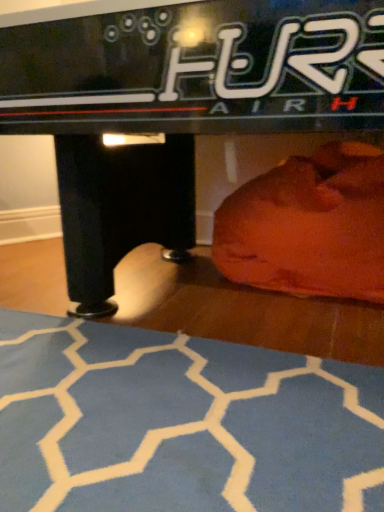
I want to click on blue textured yoga mat at lower center, so click(x=180, y=423).

Considering the positions of objects black glossy air hockey table at center and blue textured yoga mat at lower center in the image provided, who is in front, black glossy air hockey table at center or blue textured yoga mat at lower center?

blue textured yoga mat at lower center.

Could you measure the distance between black glossy air hockey table at center and blue textured yoga mat at lower center?

black glossy air hockey table at center is 21.52 inches from blue textured yoga mat at lower center.

From the image's perspective, is black glossy air hockey table at center under blue textured yoga mat at lower center?

Incorrect, from the image's perspective, black glossy air hockey table at center is higher than blue textured yoga mat at lower center.

Which object is positioned more to the left, black glossy air hockey table at center or blue textured yoga mat at lower center?

blue textured yoga mat at lower center is more to the left.

Can black glossy air hockey table at center be found inside blue textured yoga mat at lower center?

No, black glossy air hockey table at center is not a part of blue textured yoga mat at lower center.

Can you confirm if blue textured yoga mat at lower center is smaller than black glossy air hockey table at center?

Correct, blue textured yoga mat at lower center occupies less space than black glossy air hockey table at center.

From a real-world perspective, is blue textured yoga mat at lower center above or below black glossy air hockey table at center?

Clearly, from a real-world perspective, blue textured yoga mat at lower center is below black glossy air hockey table at center.

Is blue textured yoga mat at lower center positioned behind black glossy air hockey table at center?

No.

Which is more to the left, blue textured yoga mat at lower center or orange fabric bean bag at lower right?

blue textured yoga mat at lower center is more to the left.

Which object is closer to the camera taking this photo, blue textured yoga mat at lower center or orange fabric bean bag at lower right?

blue textured yoga mat at lower center is in front.

Is blue textured yoga mat at lower center not close to orange fabric bean bag at lower right?

blue textured yoga mat at lower center is actually quite close to orange fabric bean bag at lower right.

Which point is more forward, (210, 449) or (228, 238)?

Point (210, 449)

Which object is positioned more to the right, black glossy air hockey table at center or orange fabric bean bag at lower right?

From the viewer's perspective, orange fabric bean bag at lower right appears more on the right side.

Is black glossy air hockey table at center bigger than orange fabric bean bag at lower right?

Indeed, black glossy air hockey table at center has a larger size compared to orange fabric bean bag at lower right.

How different are the orientations of black glossy air hockey table at center and orange fabric bean bag at lower right in degrees?

They differ by 2.58 degrees in their facing directions.

Is there a large distance between black glossy air hockey table at center and orange fabric bean bag at lower right?

No, black glossy air hockey table at center is not far away from orange fabric bean bag at lower right.

Between point (257, 268) and point (291, 88), which one is positioned in front?

Point (291, 88)

Is orange fabric bean bag at lower right at the right side of black glossy air hockey table at center?

Yes.

How many degrees apart are the facing directions of orange fabric bean bag at lower right and black glossy air hockey table at center?

2.58 degrees.

Is black glossy air hockey table at center at the back of orange fabric bean bag at lower right?

Yes, orange fabric bean bag at lower right's orientation is away from black glossy air hockey table at center.

Which point is more distant from viewer, (312, 218) or (151, 414)?

The point (312, 218) is behind.

Is the position of orange fabric bean bag at lower right more distant than that of blue textured yoga mat at lower center?

Yes, orange fabric bean bag at lower right is behind blue textured yoga mat at lower center.

From a real-world perspective, is orange fabric bean bag at lower right under blue textured yoga mat at lower center?

No.

Locate an element on the screen. Image resolution: width=384 pixels, height=512 pixels. yoga mat that is in front of the black glossy air hockey table at center is located at coordinates (180, 423).

Locate an element on the screen. The height and width of the screenshot is (512, 384). table that is on the right side of blue textured yoga mat at lower center is located at coordinates (175, 105).

From the image, which object appears to be farther from orange fabric bean bag at lower right, blue textured yoga mat at lower center or black glossy air hockey table at center?

blue textured yoga mat at lower center.

Considering their positions, is black glossy air hockey table at center positioned further to blue textured yoga mat at lower center than orange fabric bean bag at lower right?

orange fabric bean bag at lower right.

When comparing their distances from blue textured yoga mat at lower center, does orange fabric bean bag at lower right or black glossy air hockey table at center seem further?

Among the two, orange fabric bean bag at lower right is located further to blue textured yoga mat at lower center.

From the picture: Looking at the image, which one is located further to black glossy air hockey table at center, orange fabric bean bag at lower right or blue textured yoga mat at lower center?

orange fabric bean bag at lower right is further to black glossy air hockey table at center.

Looking at the image, which one is located closer to black glossy air hockey table at center, blue textured yoga mat at lower center or orange fabric bean bag at lower right?

Based on the image, blue textured yoga mat at lower center appears to be nearer to black glossy air hockey table at center.

Based on their spatial positions, is black glossy air hockey table at center or blue textured yoga mat at lower center further from orange fabric bean bag at lower right?

blue textured yoga mat at lower center.

Find the location of a particular element. table located between blue textured yoga mat at lower center and orange fabric bean bag at lower right in the depth direction is located at coordinates (175, 105).